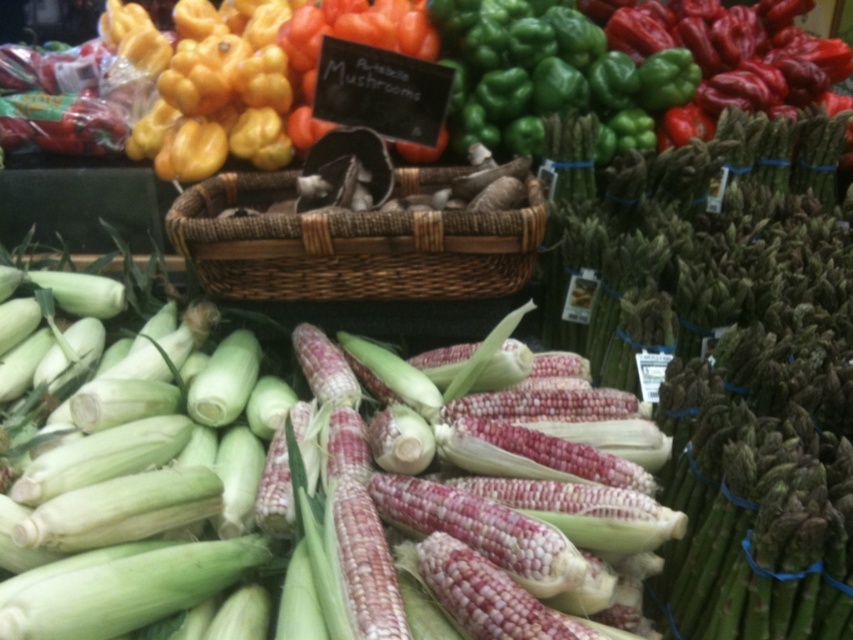
Is green matte corn at center positioned at the back of woven brown basket at center?

No.

Between green matte corn at center and woven brown basket at center, which one appears on the right side from the viewer's perspective?

From the viewer's perspective, woven brown basket at center appears more on the right side.

Is point (579, 570) positioned behind point (323, 268)?

No.

Find the location of `green matte corn at center`. green matte corn at center is located at coordinates (299, 500).